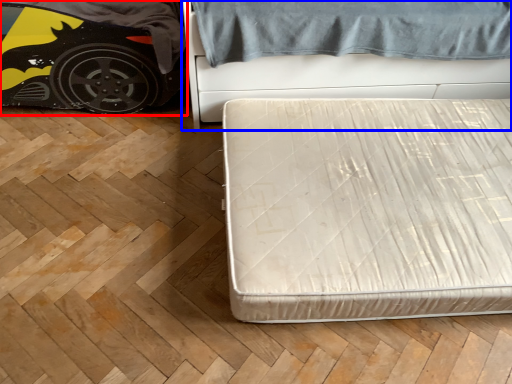
Question: Which object is closer to the camera taking this photo, car (highlighted by a red box) or bed (highlighted by a blue box)?

Choices:
 (A) car
 (B) bed

Answer: (B)